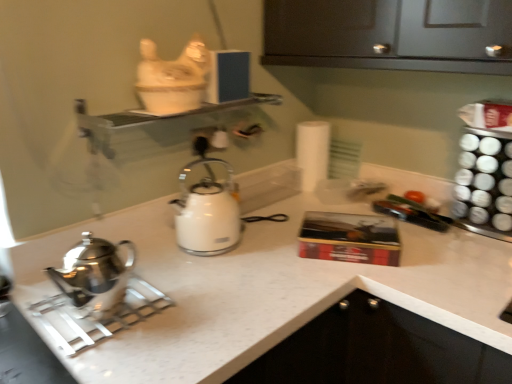
Question: Does polished stainless steel kettle at left, which is the first kettle from front to back, have a greater height compared to white matte toilet paper at center?

Choices:
 (A) no
 (B) yes

Answer: (A)

Question: From a real-world perspective, is polished stainless steel kettle at left, which is the first kettle from front to back, located higher than white matte toilet paper at center?

Choices:
 (A) yes
 (B) no

Answer: (B)

Question: From a real-world perspective, does polished stainless steel kettle at left, acting as the first kettle starting from the left, sit lower than white matte toilet paper at center?

Choices:
 (A) yes
 (B) no

Answer: (A)

Question: Is polished stainless steel kettle at left, the second kettle positioned from the back, at the right side of white matte toilet paper at center?

Choices:
 (A) yes
 (B) no

Answer: (B)

Question: From the image's perspective, does polished stainless steel kettle at left, the second kettle positioned from the back, appear lower than white matte toilet paper at center?

Choices:
 (A) no
 (B) yes

Answer: (B)

Question: From a real-world perspective, relative to white matte toilet paper at center, is clear glass shelf at upper center vertically above or below?

Choices:
 (A) below
 (B) above

Answer: (B)

Question: Considering their positions, is clear glass shelf at upper center located in front of or behind white matte toilet paper at center?

Choices:
 (A) behind
 (B) front

Answer: (B)

Question: Is point (136, 144) closer or farther from the camera than point (309, 160)?

Choices:
 (A) closer
 (B) farther

Answer: (A)

Question: From the image's perspective, relative to white matte toilet paper at center, is clear glass shelf at upper center above or below?

Choices:
 (A) below
 (B) above

Answer: (B)

Question: Based on their sizes in the image, would you say polished stainless steel kettle at left, the second kettle when ordered from right to left, is bigger or smaller than clear glass shelf at upper center?

Choices:
 (A) small
 (B) big

Answer: (A)

Question: From the image's perspective, is polished stainless steel kettle at left, the second kettle positioned from the back, positioned above or below clear glass shelf at upper center?

Choices:
 (A) below
 (B) above

Answer: (A)

Question: In the image, is polished stainless steel kettle at left, acting as the first kettle starting from the left, positioned in front of or behind clear glass shelf at upper center?

Choices:
 (A) front
 (B) behind

Answer: (A)

Question: Considering the positions of point (109, 284) and point (86, 114), is point (109, 284) closer or farther from the camera than point (86, 114)?

Choices:
 (A) farther
 (B) closer

Answer: (B)

Question: From the image's perspective, is clear glass shelf at upper center located above or below polished stainless steel kettle at left, acting as the first kettle starting from the left?

Choices:
 (A) below
 (B) above

Answer: (B)

Question: Considering the positions of clear glass shelf at upper center and polished stainless steel kettle at left, which is the first kettle from front to back, in the image, is clear glass shelf at upper center wider or thinner than polished stainless steel kettle at left, which is the first kettle from front to back,?

Choices:
 (A) thin
 (B) wide

Answer: (B)